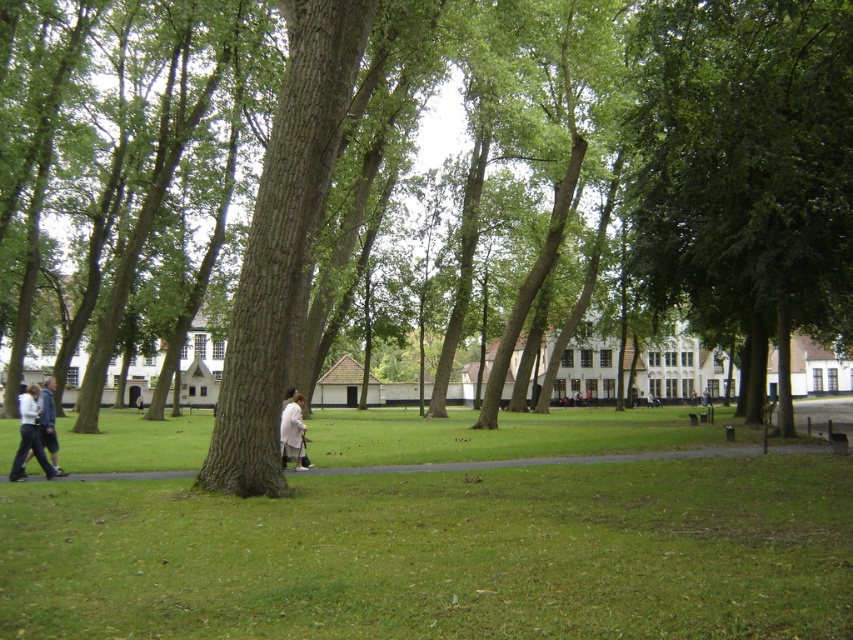
You are a photographer standing in the park and want to take a photo of the green rough bark tree at center and the white cotton jacket at lower left. Since you want both subjects to be in focus, which one should you focus on first to ensure proper depth of field?

The green rough bark tree at center is in front of the white cotton jacket at lower left, so you should focus on the white cotton jacket at lower left first to ensure both are in focus.

You are standing at the center of the park and want to find the green rough bark tree at center. According to the coordinates provided, in which direction should you walk to reach it?

Result: The green rough bark tree at center is located at coordinates point (674, 160), which means it is positioned to the left and slightly forward from your current position at the center. You should walk towards the left direction to reach it.

You are a person standing in the park and want to place your white cotton jacket at lower left on the green grass at lower center. Will the jacket fit entirely on the grass without any part hanging off?

The green grass at lower center has a larger width than the white cotton jacket at lower left, so the jacket will fit entirely on the grass without any part hanging off.